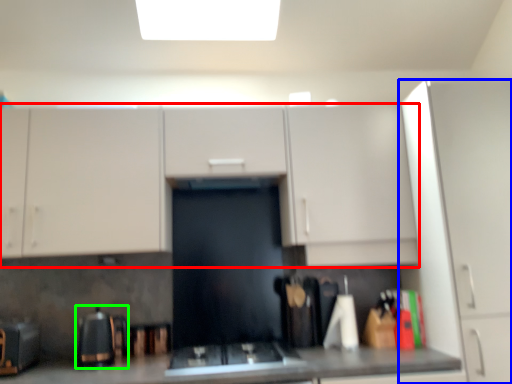
Question: Considering the real-world distances, which object is closest to cabinetry (highlighted by a red box)? cabinetry (highlighted by a blue box) or appliance (highlighted by a green box).

Choices:
 (A) cabinetry
 (B) appliance

Answer: (A)